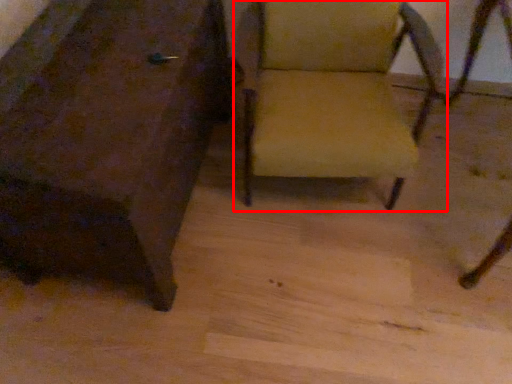
Question: From the image's perspective, what is the correct spatial relationship of chair (annotated by the red box) in relation to chair?

Choices:
 (A) above
 (B) below

Answer: (A)